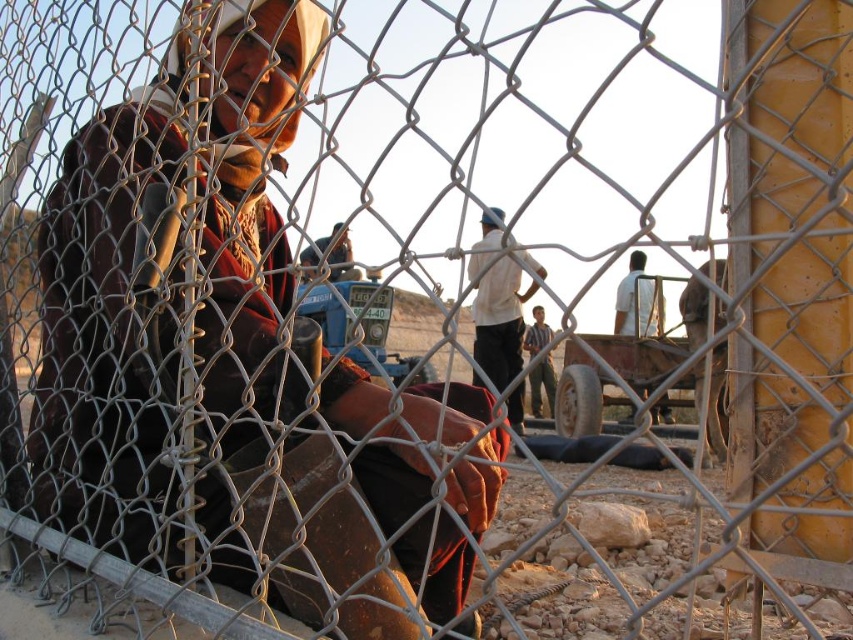
At what (x,y) coordinates should I click in order to perform the action: click on white cotton shirt at center. Please return your answer as a coordinate pair (x, y). Looking at the image, I should click on (498, 321).